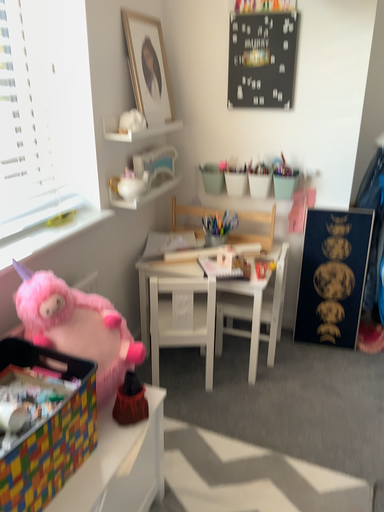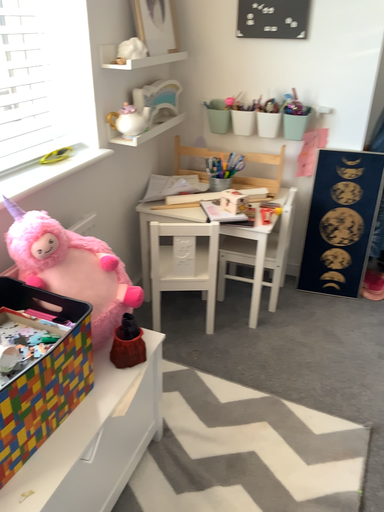
Question: Which way did the camera rotate in the video?

Choices:
 (A) rotated downward
 (B) rotated upward

Answer: (A)